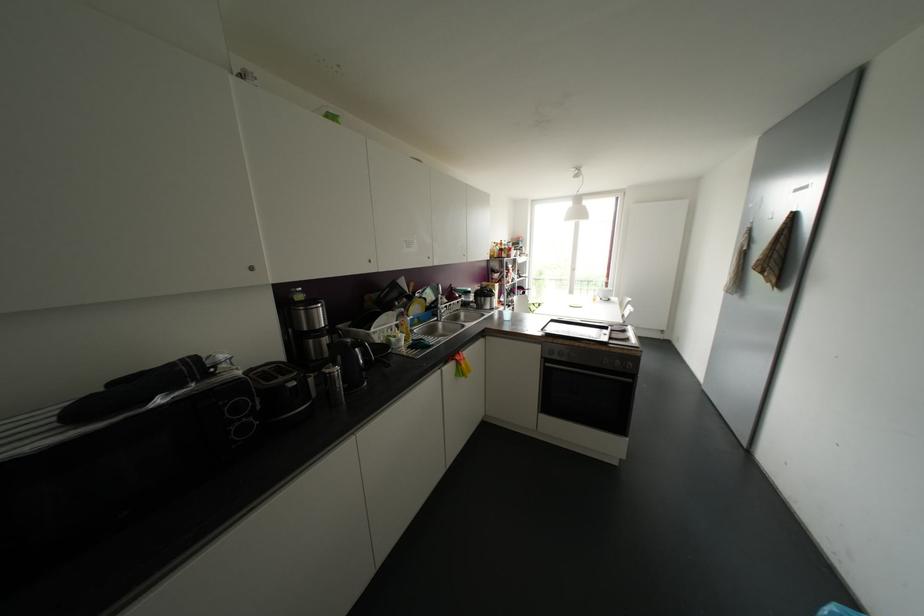
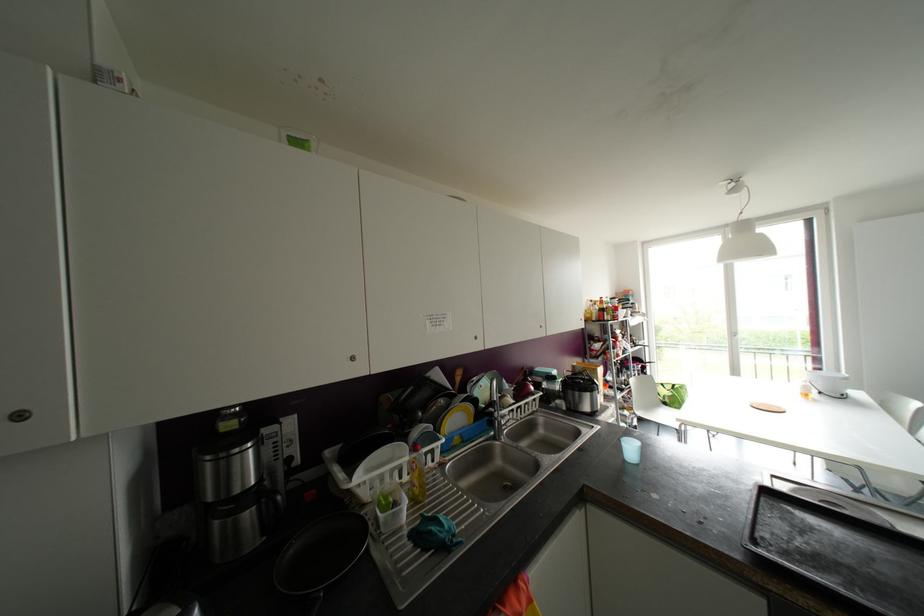
Find the pixel in the second image that matches (505,314) in the first image.

(629, 448)